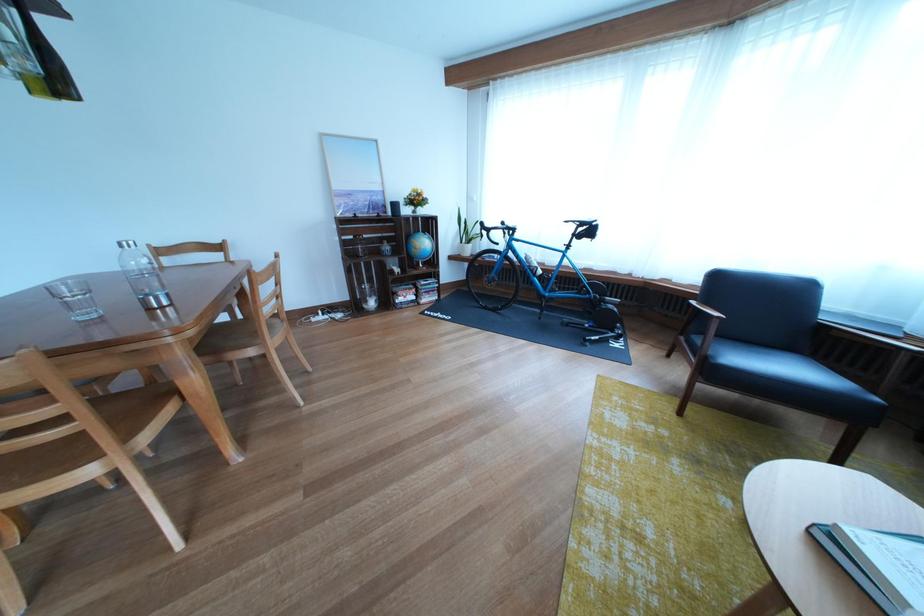
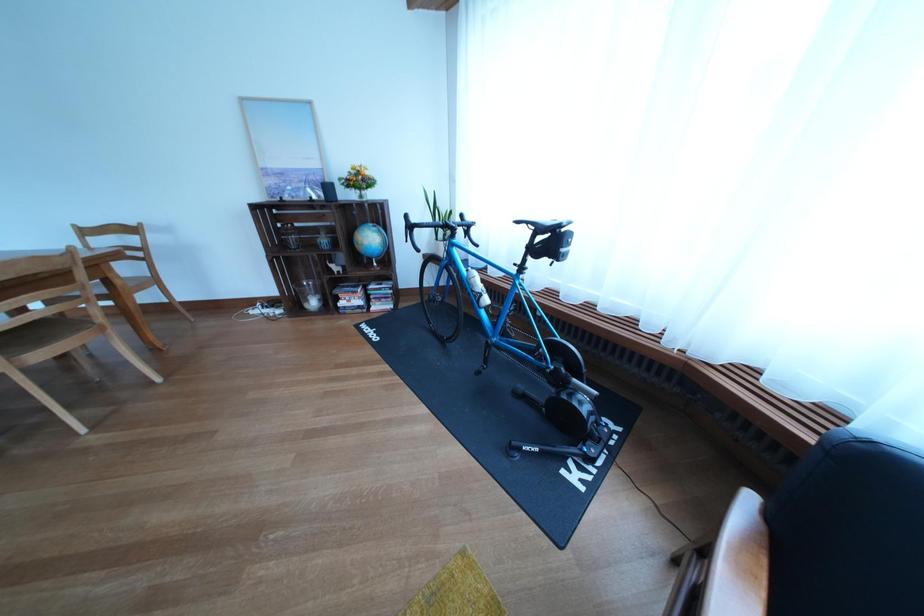
Question: I am providing you with two images of the same scene from different viewpoints. Which of the following objects are not visible in image2?

Choices:
 (A) white water bottle
 (B) framed picture
 (C) wooden chair sitting surface
 (D) none of these

Answer: (D)